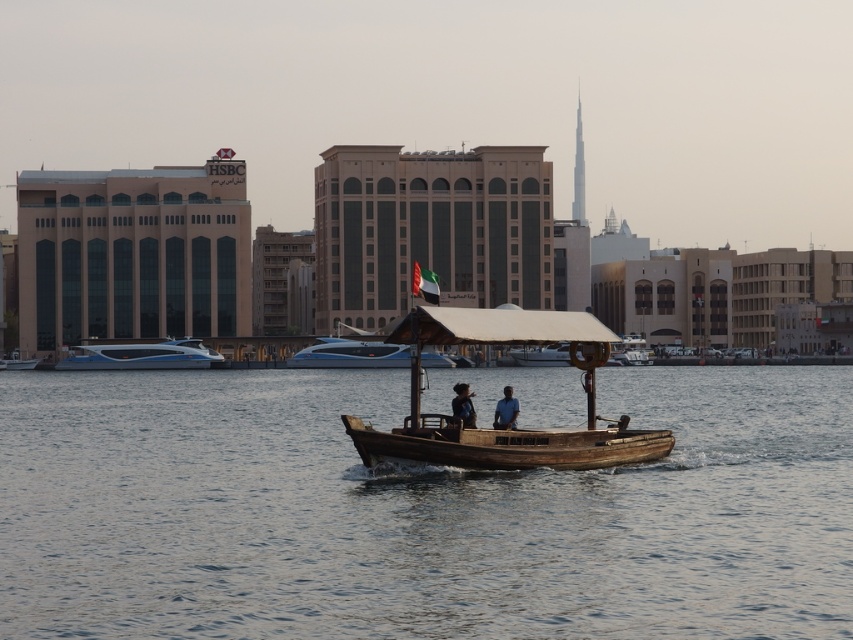
Question: Can you confirm if smooth water at center is positioned above blue glossy speedboat at left?

Choices:
 (A) no
 (B) yes

Answer: (A)

Question: Which of the following is the farthest from the observer?

Choices:
 (A) wooden boat at center
 (B) blue glossy speedboat at left
 (C) smooth water at center
 (D) white glossy speedboat at center

Answer: (B)

Question: Can you confirm if blue glossy speedboat at left is bigger than white glossy speedboat at center?

Choices:
 (A) yes
 (B) no

Answer: (B)

Question: Is the position of smooth water at center more distant than that of white glossy speedboat at center?

Choices:
 (A) no
 (B) yes

Answer: (A)

Question: Which object is the closest to the smooth water at center?

Choices:
 (A) white glossy speedboat at center
 (B) wooden boat at center
 (C) blue glossy speedboat at left

Answer: (B)

Question: Which point is closer to the camera taking this photo?

Choices:
 (A) (425, 323)
 (B) (427, 632)
 (C) (97, 365)
 (D) (450, 358)

Answer: (B)